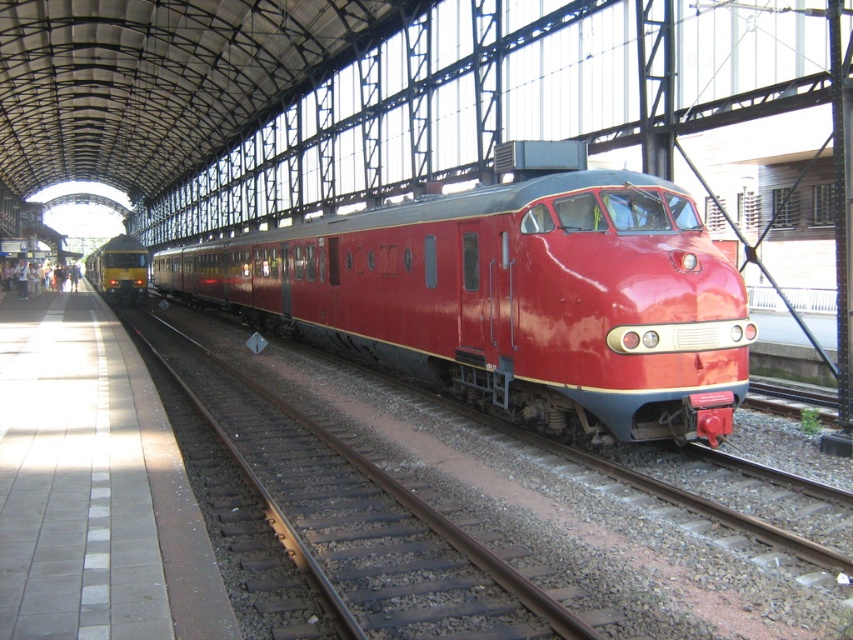
Question: Among these objects, which one is farthest from the camera?

Choices:
 (A) glossy red train at center
 (B) metal/rusty track at center

Answer: (A)

Question: Estimate the real-world distances between objects in this image. Which object is closer to the glossy red train at center?

Choices:
 (A) metallic yellow train at left
 (B) metal/rusty track at center

Answer: (B)

Question: Observing the image, what is the correct spatial positioning of metal/rusty track at center in reference to glossy red train at center?

Choices:
 (A) left
 (B) right

Answer: (B)

Question: Is glossy red train at center positioned behind metallic yellow train at left?

Choices:
 (A) no
 (B) yes

Answer: (A)

Question: Is glossy red train at center wider than metallic yellow train at left?

Choices:
 (A) yes
 (B) no

Answer: (B)

Question: Among these points, which one is farthest from the camera?

Choices:
 (A) (602, 278)
 (B) (769, 596)
 (C) (126, 276)

Answer: (C)